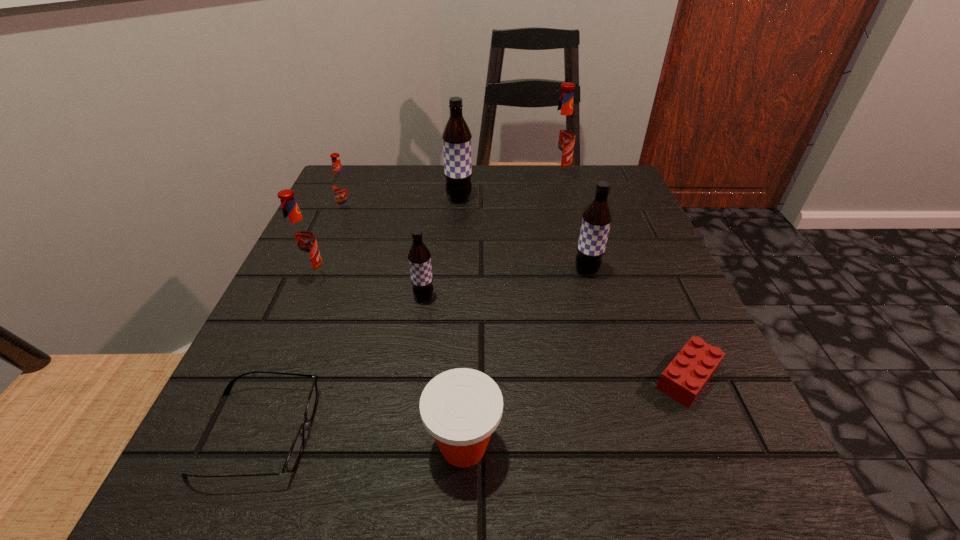
Where is `the farthest red root beer`? Image resolution: width=960 pixels, height=540 pixels. the farthest red root beer is located at coordinates (561, 138).

At what (x,y) coordinates should I click in order to perform the action: click on the rightmost red root beer. Please return your answer as a coordinate pair (x, y). Image resolution: width=960 pixels, height=540 pixels. Looking at the image, I should click on (561, 138).

Find the location of a particular element. the farthest brown root beer is located at coordinates (456, 136).

Find the location of `the biggest brown root beer`. the biggest brown root beer is located at coordinates (456, 136).

Find the location of a particular element. The width and height of the screenshot is (960, 540). the nearest red root beer is located at coordinates (300, 240).

Find the location of a particular element. This screenshot has width=960, height=540. the second biggest brown root beer is located at coordinates (597, 217).

The image size is (960, 540). Find the location of `the rightmost brown root beer`. the rightmost brown root beer is located at coordinates (597, 217).

The image size is (960, 540). I want to click on the second farthest red root beer, so click(341, 185).

Locate an element on the screen. the third farthest object is located at coordinates (341, 185).

What are the coordinates of `the fourth nearest object` in the screenshot? It's located at (419, 256).